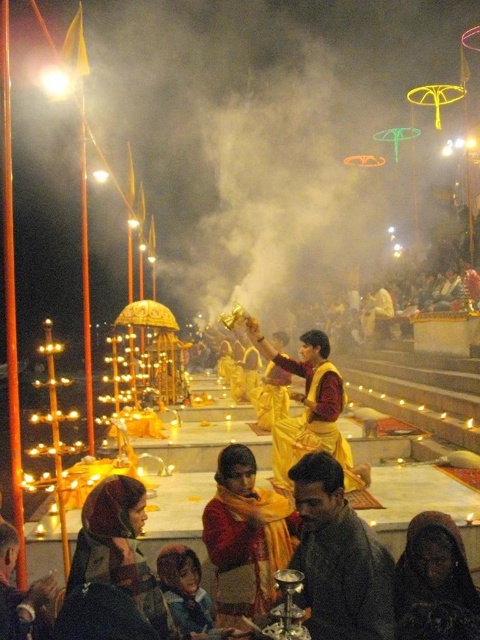
You are an attendee at this ceremony and need to determine which item is wider between the dark fabric headscarf at lower right and the yellow silk robe at center. Can you identify which one is wider?

The dark fabric headscarf at lower right is wider than the yellow silk robe at center according to the description.

You are a photographer at the ceremony. You want to capture a photo that includes both the dark fabric headscarf at lower right and the yellow silk robe at center. Which object should you adjust your camera angle to focus on first to ensure both are in frame?

The dark fabric headscarf at lower right is below the yellow silk robe at center, so you should focus on the yellow silk robe at center first to ensure both are in frame.